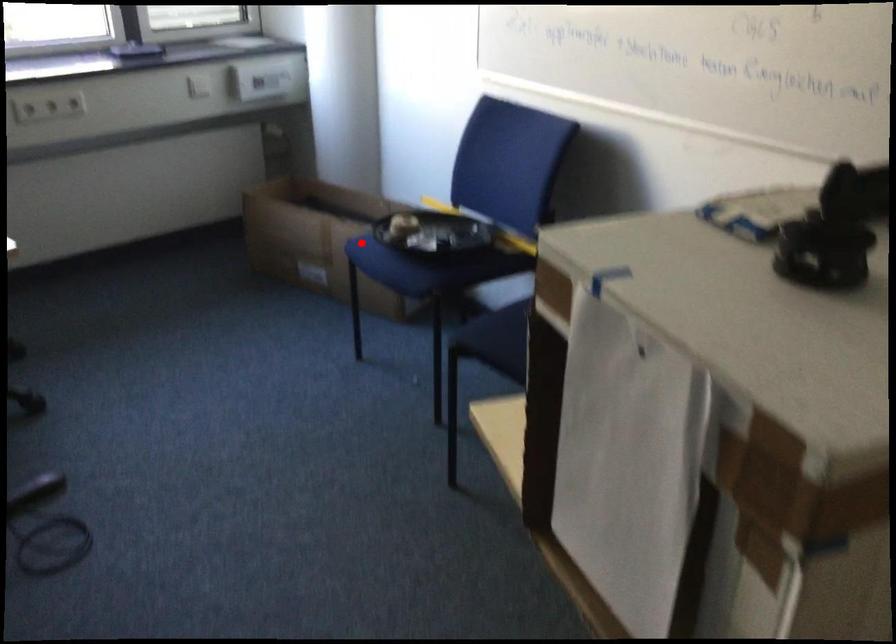
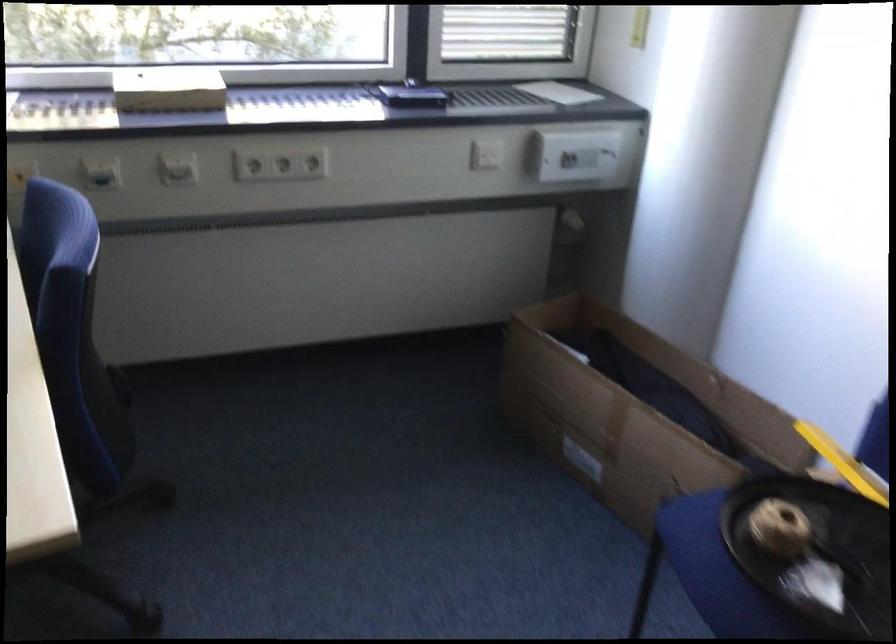
Question: I am providing you with two images of the same scene from different viewpoints. A red point is shown in image1. For the corresponding object point in image2, is it positioned nearer or farther from the camera?

Choices:
 (A) Nearer
 (B) Farther

Answer: (A)